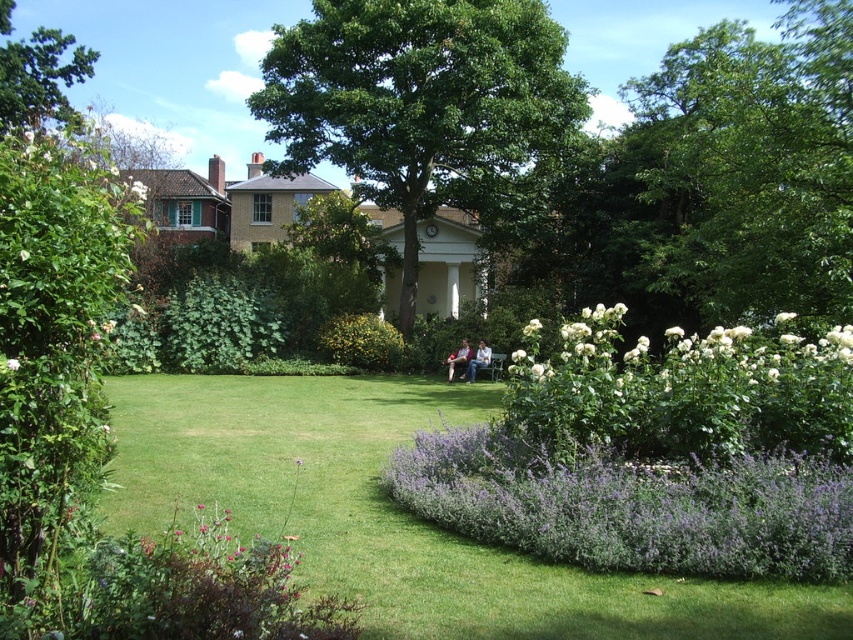
Question: Estimate the real-world distances between objects in this image. Which object is closer to the white fluffy flowers at right?

Choices:
 (A) light brown wooden chair at center
 (B) purple leafy bush at lower center
 (C) white matte flower at center
 (D) green leafy tree at center

Answer: (B)

Question: Can you confirm if green leafy tree at upper left is bigger than white matte flower at center?

Choices:
 (A) no
 (B) yes

Answer: (B)

Question: Can you confirm if green leafy tree at center is positioned to the left of green leafy tree at upper left?

Choices:
 (A) no
 (B) yes

Answer: (A)

Question: Estimate the real-world distances between objects in this image. Which object is farther from the white fluffy flower at center?

Choices:
 (A) light brown wooden chair at center
 (B) green leafy tree at center

Answer: (B)

Question: Does green leafy tree at upper right appear over light brown wooden chair at center?

Choices:
 (A) yes
 (B) no

Answer: (A)

Question: Which object is farther from the camera taking this photo?

Choices:
 (A) white fluffy flower at center
 (B) green leafy tree at center
 (C) white fluffy flowers at right

Answer: (B)